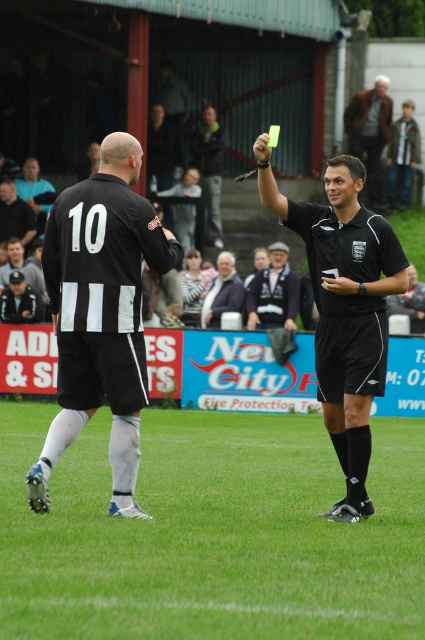
Question: Which point appears closest to the camera in this image?

Choices:
 (A) (23, 192)
 (B) (88, 298)

Answer: (B)

Question: Which point is closer to the camera taking this photo?

Choices:
 (A) (203, 124)
 (B) (391, 285)
 (C) (17, 186)

Answer: (B)

Question: Can you confirm if dark blue fabric jacket at center is thinner than dark gray jersey at left?

Choices:
 (A) yes
 (B) no

Answer: (B)

Question: Is green fabric jacket at upper center closer to camera compared to dark gray jersey at left?

Choices:
 (A) no
 (B) yes

Answer: (A)

Question: Among these points, which one is nearest to the camera?

Choices:
 (A) (385, 100)
 (B) (197, 227)
 (C) (249, 307)

Answer: (C)

Question: Is black matte jersey at center wider than dark gray fabric jacket at left?

Choices:
 (A) yes
 (B) no

Answer: (A)